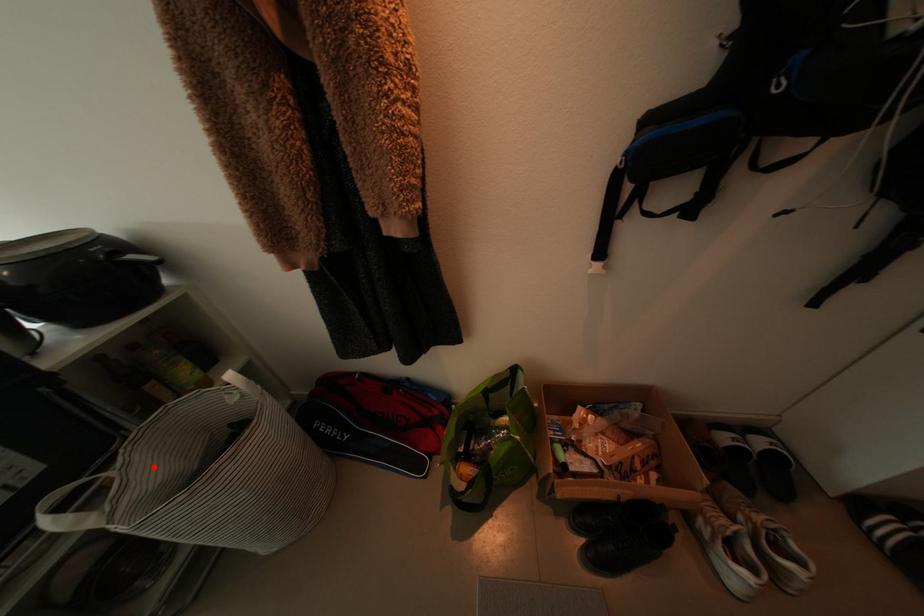
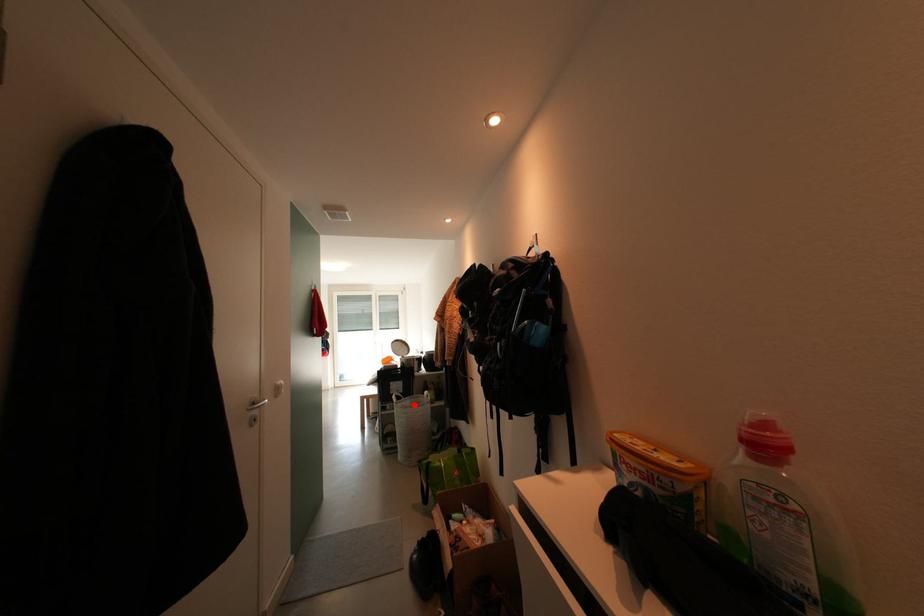
I am providing you with two images of the same scene from different viewpoints. A red point is marked on the first image and another point is marked on the second image. Is the marked point in image1 the same physical position as the marked point in image2?

Yes